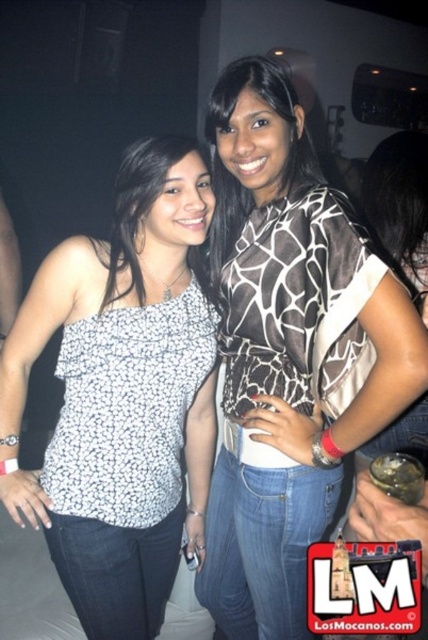
Question: Is giraffe-patterned top at center thinner than white printed tank top at center?

Choices:
 (A) yes
 (B) no

Answer: (A)

Question: Does giraffe-patterned top at center have a larger size compared to white printed tank top at center?

Choices:
 (A) no
 (B) yes

Answer: (B)

Question: Is giraffe-patterned top at center wider than white printed tank top at center?

Choices:
 (A) no
 (B) yes

Answer: (A)

Question: Which point is farther from the camera taking this photo?

Choices:
 (A) (353, 387)
 (B) (30, 474)

Answer: (B)